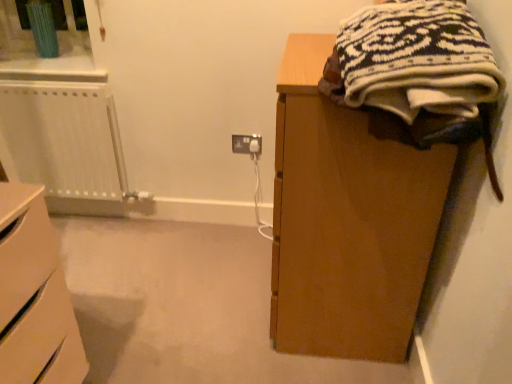
Question: Is knitted wool sweater at upper right touching matte white socket at center?

Choices:
 (A) yes
 (B) no

Answer: (B)

Question: From the image's perspective, is knitted wool sweater at upper right above matte white socket at center?

Choices:
 (A) no
 (B) yes

Answer: (B)

Question: Does knitted wool sweater at upper right have a greater height compared to matte white socket at center?

Choices:
 (A) no
 (B) yes

Answer: (B)

Question: Considering the relative sizes of knitted wool sweater at upper right and matte white socket at center in the image provided, is knitted wool sweater at upper right thinner than matte white socket at center?

Choices:
 (A) no
 (B) yes

Answer: (A)

Question: Can you confirm if knitted wool sweater at upper right is positioned to the left of matte white socket at center?

Choices:
 (A) yes
 (B) no

Answer: (B)

Question: Could you tell me if knitted wool sweater at upper right is turned towards matte white socket at center?

Choices:
 (A) no
 (B) yes

Answer: (A)

Question: From a real-world perspective, is matte white socket at center positioned over knitted wool sweater at upper right based on gravity?

Choices:
 (A) yes
 (B) no

Answer: (B)

Question: Considering the relative sizes of matte white socket at center and knitted wool sweater at upper right in the image provided, is matte white socket at center thinner than knitted wool sweater at upper right?

Choices:
 (A) yes
 (B) no

Answer: (A)

Question: Is matte white socket at center closer to the viewer compared to knitted wool sweater at upper right?

Choices:
 (A) yes
 (B) no

Answer: (B)

Question: From a real-world perspective, is matte white socket at center below knitted wool sweater at upper right?

Choices:
 (A) no
 (B) yes

Answer: (B)

Question: From the image's perspective, is matte white socket at center located beneath knitted wool sweater at upper right?

Choices:
 (A) yes
 (B) no

Answer: (A)

Question: Is matte white socket at center surrounding knitted wool sweater at upper right?

Choices:
 (A) yes
 (B) no

Answer: (B)

Question: Considering the relative sizes of knitted wool sweater at upper right and white plastic radiator at left in the image provided, is knitted wool sweater at upper right smaller than white plastic radiator at left?

Choices:
 (A) yes
 (B) no

Answer: (B)